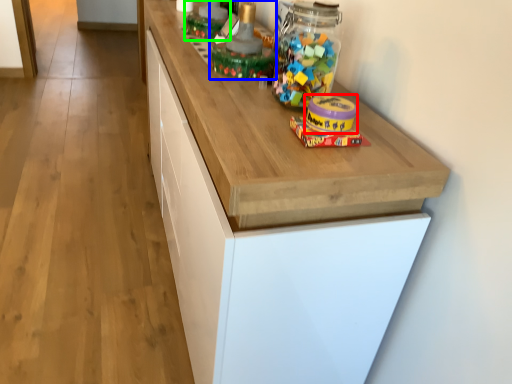
Question: Which is farther away from toy (highlighted by a red box)? toy (highlighted by a blue box) or toy (highlighted by a green box)?

Choices:
 (A) toy
 (B) toy

Answer: (B)